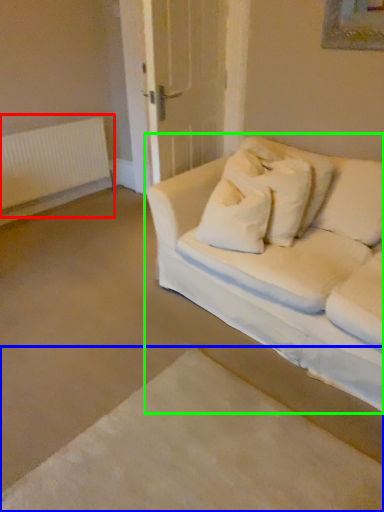
Question: Based on their relative distances, which object is farther from radiator (highlighted by a red box)? Choose from bed frame (highlighted by a blue box) and studio couch (highlighted by a green box).

Choices:
 (A) bed frame
 (B) studio couch

Answer: (A)